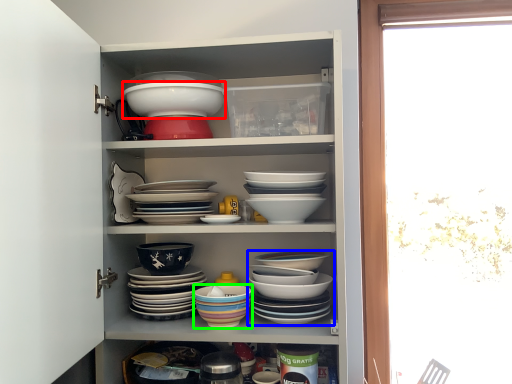
Question: Based on their relative distances, which object is farther from bowl (highlighted by a red box)? Choose from bowl (highlighted by a blue box) and bowl (highlighted by a green box).

Choices:
 (A) bowl
 (B) bowl

Answer: (A)